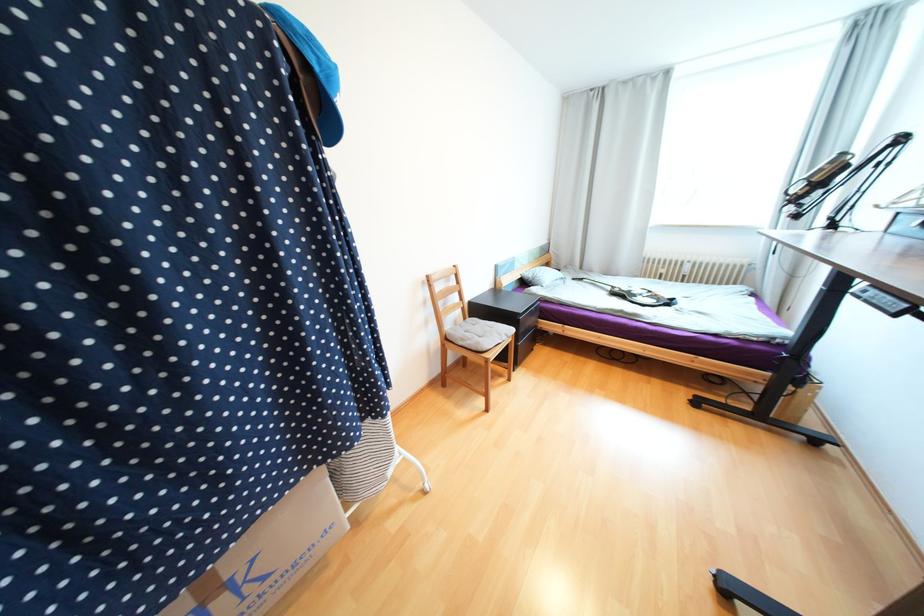
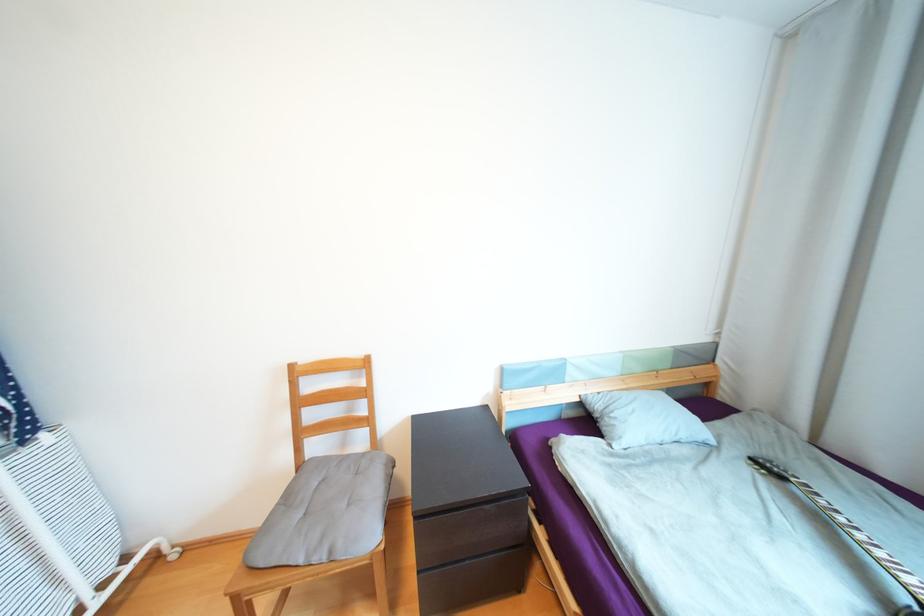
Locate, in the second image, the point that corresponds to pixel 513 334 in the first image.

(335, 553)